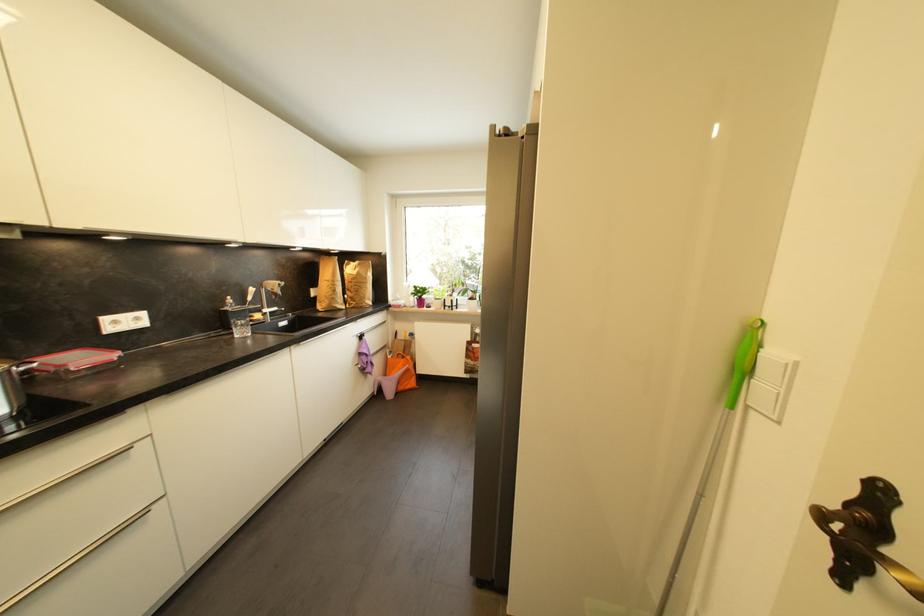
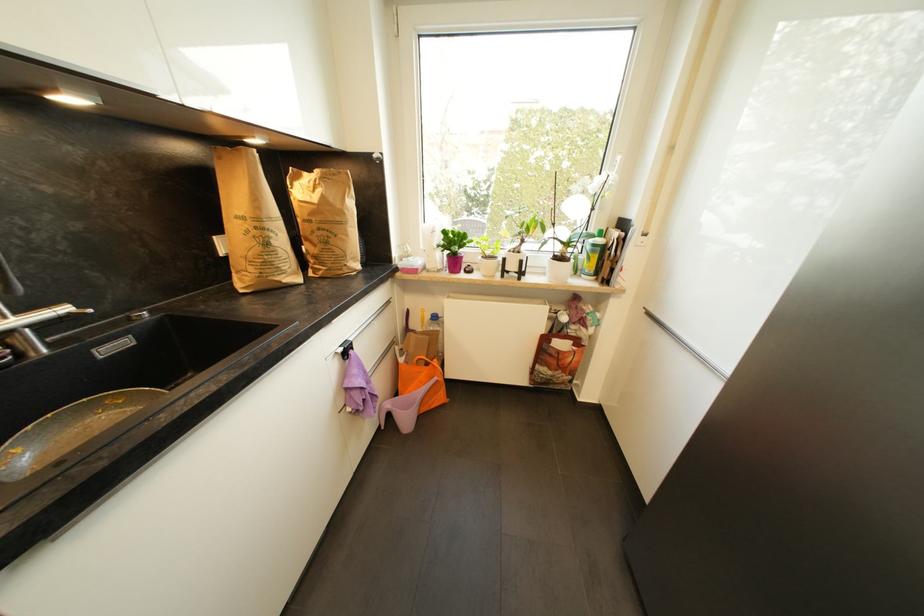
Find the pixel in the second image that matches (x=477, y=365) in the first image.

(554, 375)